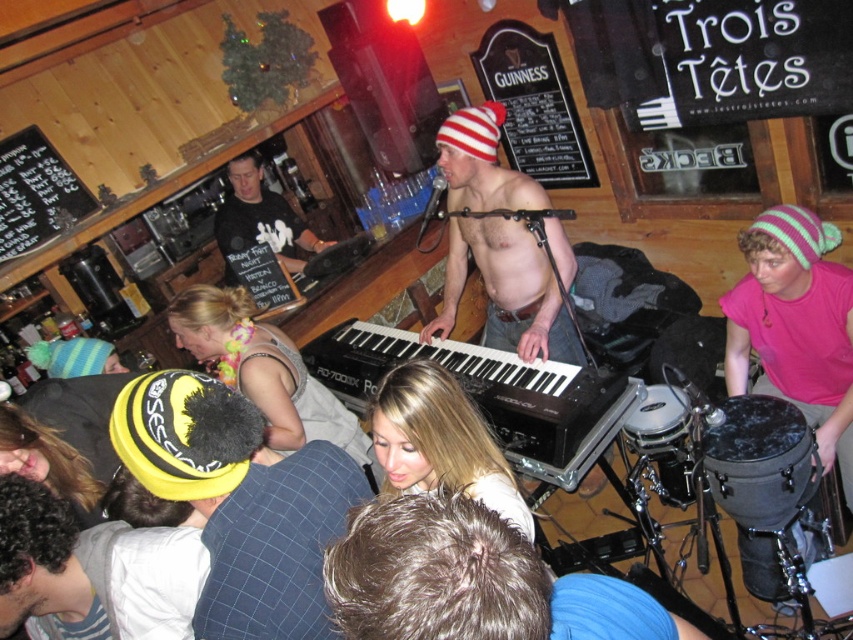
Based on the scene description, if you were standing in the venue and looking towards the stage, which object would you see first between the black plastic keyboard at center and the black matte shirt at center?

The black matte shirt at center would be seen first because it is positioned above the black plastic keyboard at center.

Looking at this image, you are standing at the entrance of the bar and want to locate the yellow fuzzy hat at lower left. According to the coordinates provided, where should you look?

The yellow fuzzy hat at lower left is located at coordinates point [241,500].